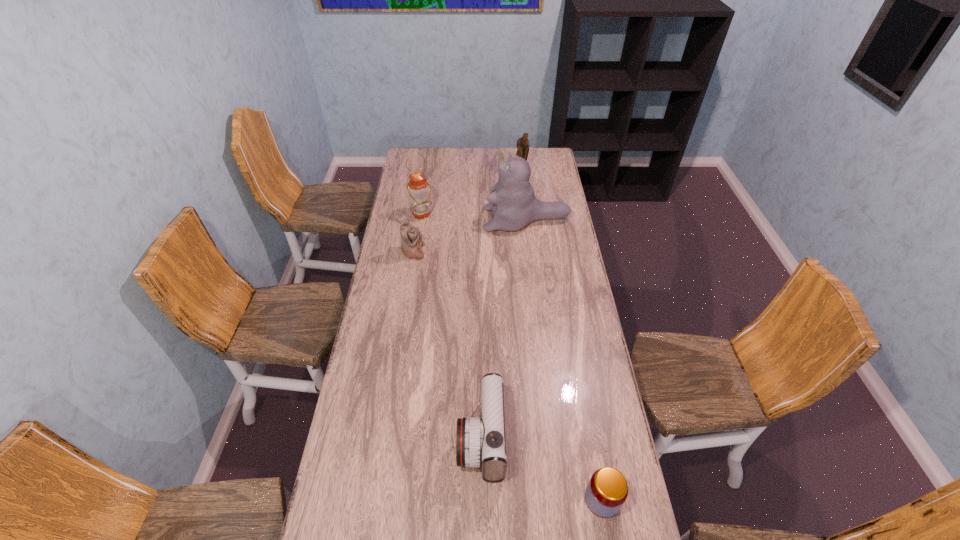
Identify the location of cat. This screenshot has width=960, height=540. (514, 205).

At what (x,y) coordinates should I click in order to perform the action: click on oil lamp. Please return your answer as a coordinate pair (x, y). Looking at the image, I should click on (420, 203).

Locate an element on the screen. This screenshot has height=540, width=960. the farthest object is located at coordinates (523, 145).

The width and height of the screenshot is (960, 540). Identify the location of the right figurine. (523, 145).

The height and width of the screenshot is (540, 960). In order to click on the nearer figurine in this screenshot , I will do `click(411, 238)`.

Find the location of a particular element. This screenshot has height=540, width=960. the left figurine is located at coordinates (411, 238).

Where is `the fifth tallest object`? the fifth tallest object is located at coordinates (480, 442).

Find the location of `jar`. jar is located at coordinates (607, 490).

The height and width of the screenshot is (540, 960). I want to click on free space located 0.280m on the face of the cat, so click(425, 219).

Find the location of a particular element. This screenshot has width=960, height=540. blank space located on the face of the cat is located at coordinates (440, 219).